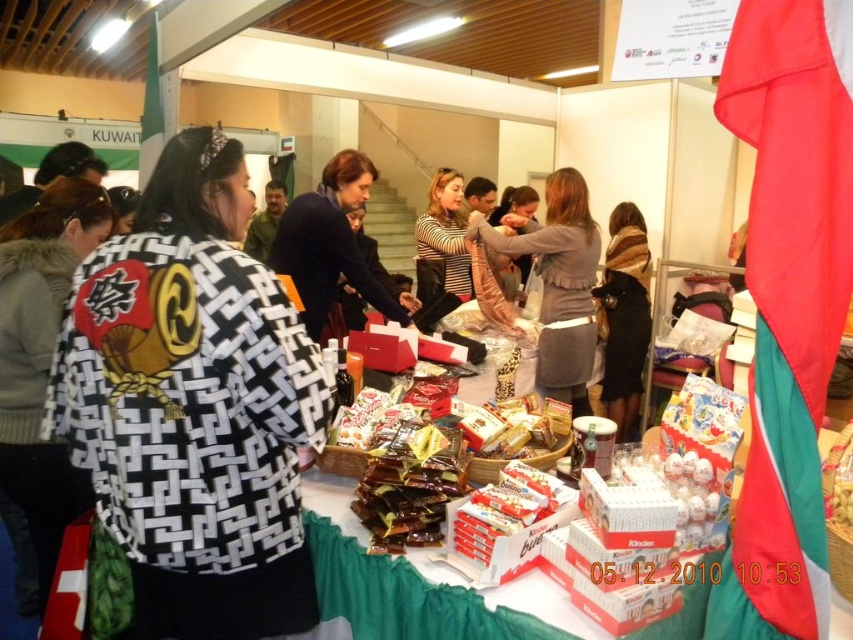
Question: Which point is farther from the camera taking this photo?

Choices:
 (A) (532, 253)
 (B) (247, 248)
 (C) (42, 497)

Answer: (B)

Question: Is black and white patterned kimono at center smaller than brown wool scarf at center?

Choices:
 (A) yes
 (B) no

Answer: (B)

Question: Which of these objects is positioned farthest from the black and white patterned kimono at left?

Choices:
 (A) matte black jacket at center
 (B) black and white patterned kimono at center
 (C) green matte jacket at center

Answer: (C)

Question: Is brown wool scarf at center thinner than green matte jacket at center?

Choices:
 (A) no
 (B) yes

Answer: (A)

Question: Which of the following is the farthest from the observer?

Choices:
 (A) (299, 198)
 (B) (200, 352)
 (C) (259, 253)

Answer: (C)

Question: Does black and white patterned kimono at center have a larger size compared to black and white patterned kimono at left?

Choices:
 (A) no
 (B) yes

Answer: (B)